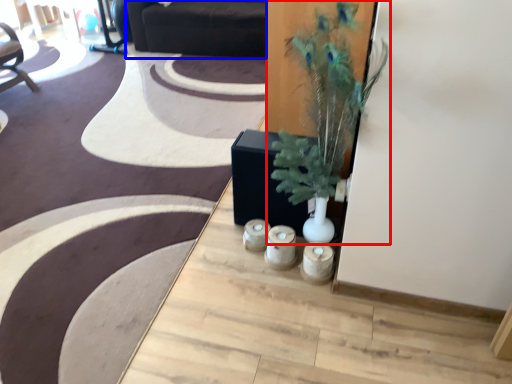
Question: Which of the following is the closest to the observer, houseplant (highlighted by a red box) or couch (highlighted by a blue box)?

Choices:
 (A) houseplant
 (B) couch

Answer: (A)